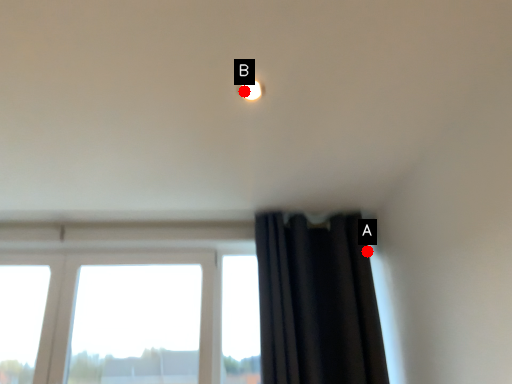
Question: Two points are circled on the image, labeled by A and B beside each circle. Which of the following is the closest to the observer?

Choices:
 (A) A is closer
 (B) B is closer

Answer: (B)